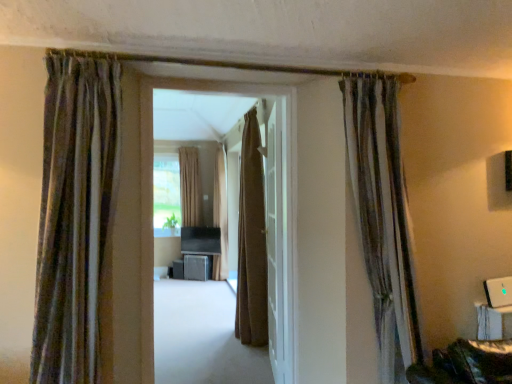
Question: In terms of height, does brown textured curtain at center, the 3th curtain viewed from the left, look taller or shorter compared to metallic gray cabinet at center, which appears as the 2th furniture when viewed from the left?

Choices:
 (A) short
 (B) tall

Answer: (B)

Question: Is brown textured curtain at center, the 3th curtain viewed from the left, in front of or behind metallic gray cabinet at center, which appears as the 2th furniture when viewed from the left, in the image?

Choices:
 (A) behind
 (B) front

Answer: (B)

Question: Estimate the real-world distances between objects in this image. Which object is farther from the matte black speaker at center, the first furniture from the left?

Choices:
 (A) metallic gray cabinet at center, the 1th furniture in the right-to-left sequence
 (B) white glossy door at center
 (C) textured brown curtain at right, the fifth curtain from the left
 (D) matte brown carpet at center
 (E) brown fabric curtain at center, the 4th curtain positioned from the left

Answer: (C)

Question: Which object is the farthest from the beige fabric curtain at center, which is the 5th curtain from front to back?

Choices:
 (A) metallic gray cabinet at center, which appears as the 2th furniture when viewed from the left
 (B) brown textured curtain at center, the third curtain in the right-to-left sequence
 (C) brown fabric curtain at center, the 3th curtain from the front
 (D) white glossy door at center
 (E) textured brown curtain at right, positioned as the second curtain in front-to-back order

Answer: (E)